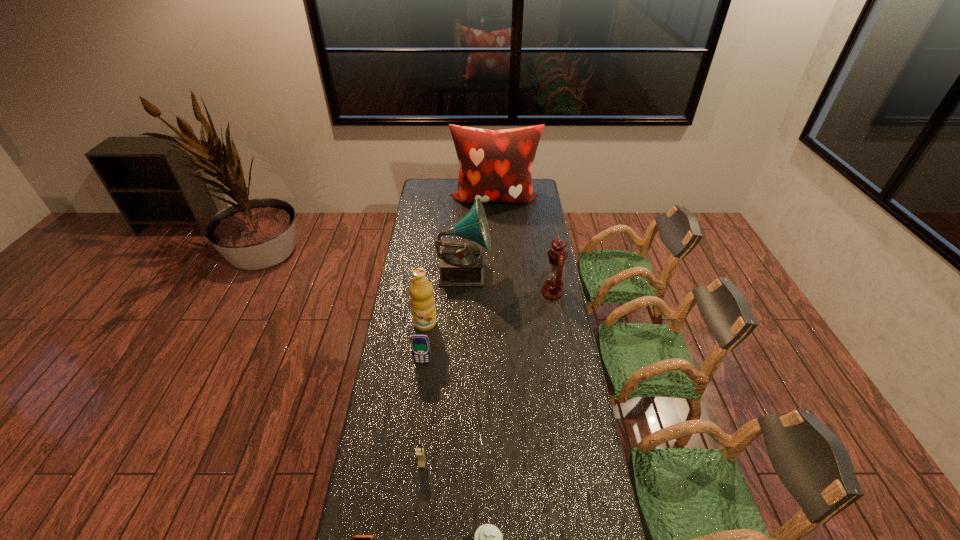
You are a GUI agent. You are given a task and a screenshot of the screen. Output one action in this format:
    pyautogui.click(x=<x>, y=<y>)
    Task: Click on the vacant space located on the label of the olive oil
    Image resolution: width=960 pixels, height=540 pixels.
    Given the screenshot: What is the action you would take?
    pyautogui.click(x=422, y=347)

At what (x,y) coordinates should I click in order to perform the action: click on vacant space located on the front-facing side of the fifth farthest object. Please return your answer as a coordinate pair (x, y). The width and height of the screenshot is (960, 540). Looking at the image, I should click on (416, 421).

Identify the location of blank space located 0.130m on the front of the third nearest object, where the keypad is located. The height and width of the screenshot is (540, 960). (418, 510).

This screenshot has height=540, width=960. I want to click on object present at the far edge, so click(495, 166).

Image resolution: width=960 pixels, height=540 pixels. I want to click on olive oil present at the left edge, so click(x=422, y=300).

Where is `cellular telephone that is at the left edge`? cellular telephone that is at the left edge is located at coordinates (420, 346).

I want to click on cushion that is at the right edge, so click(495, 166).

Image resolution: width=960 pixels, height=540 pixels. What are the coordinates of `oil lamp present at the right edge` in the screenshot? It's located at (552, 289).

Find the location of `object located in the far right corner section of the desktop`. object located in the far right corner section of the desktop is located at coordinates (495, 166).

The height and width of the screenshot is (540, 960). In the image, there is a desktop. Identify the location of vacant area at the left edge. (384, 372).